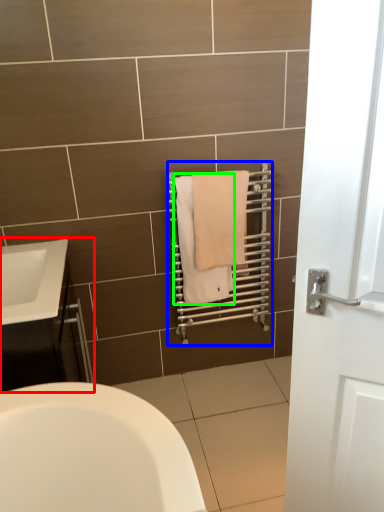
Question: Estimate the real-world distances between objects in this image. Which object is closer to bathroom cabinet (highlighted by a red box), balustrade (highlighted by a blue box) or bath towel (highlighted by a green box)?

Choices:
 (A) balustrade
 (B) bath towel

Answer: (B)